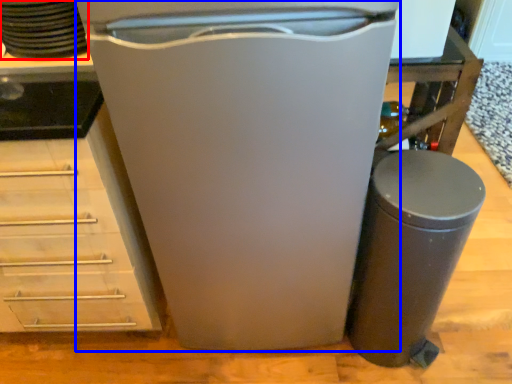
Question: Which object appears closest to the camera in this image, appliance (highlighted by a red box) or home appliance (highlighted by a blue box)?

Choices:
 (A) appliance
 (B) home appliance

Answer: (B)